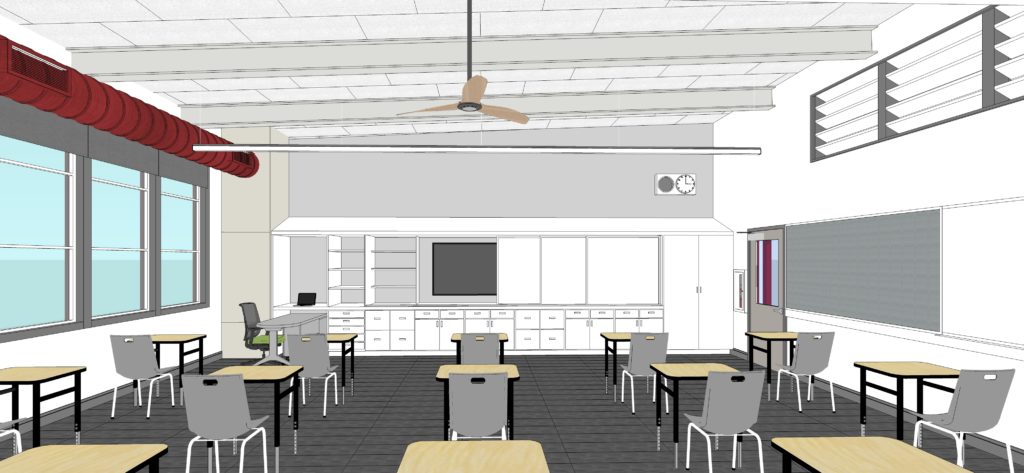
Identify the location of table. (276, 317), (272, 375), (463, 462), (101, 447), (836, 446), (682, 368), (892, 369), (779, 336), (606, 332).